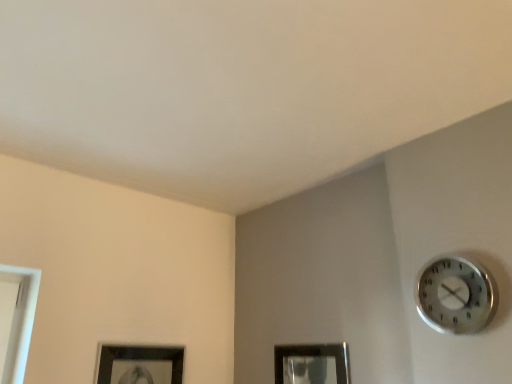
Question: Should I look upward or downward to see matte black picture frame at lower center?

Choices:
 (A) up
 (B) down

Answer: (B)

Question: Considering the relative sizes of silver metallic clock at upper right and matte black picture frame at lower center in the image provided, is silver metallic clock at upper right smaller than matte black picture frame at lower center?

Choices:
 (A) yes
 (B) no

Answer: (B)

Question: Is silver metallic clock at upper right taller than matte black picture frame at lower center?

Choices:
 (A) no
 (B) yes

Answer: (A)

Question: Considering the relative sizes of silver metallic clock at upper right and matte black picture frame at lower center in the image provided, is silver metallic clock at upper right wider than matte black picture frame at lower center?

Choices:
 (A) no
 (B) yes

Answer: (B)

Question: Is silver metallic clock at upper right surrounding matte black picture frame at lower center?

Choices:
 (A) yes
 (B) no

Answer: (B)

Question: Is the position of silver metallic clock at upper right more distant than that of matte black picture frame at lower center?

Choices:
 (A) yes
 (B) no

Answer: (B)

Question: From a real-world perspective, is silver metallic clock at upper right positioned under matte black picture frame at lower center based on gravity?

Choices:
 (A) yes
 (B) no

Answer: (B)

Question: From the image's perspective, does matte black picture frame at lower center appear lower than silver metallic clock at upper right?

Choices:
 (A) no
 (B) yes

Answer: (B)

Question: Does matte black picture frame at lower center have a lesser height compared to silver metallic clock at upper right?

Choices:
 (A) no
 (B) yes

Answer: (A)

Question: From a real-world perspective, is matte black picture frame at lower center positioned under silver metallic clock at upper right based on gravity?

Choices:
 (A) yes
 (B) no

Answer: (A)

Question: From a real-world perspective, is matte black picture frame at lower center physically above silver metallic clock at upper right?

Choices:
 (A) no
 (B) yes

Answer: (A)

Question: Is silver metallic clock at upper right at the back of matte black picture frame at lower center?

Choices:
 (A) yes
 (B) no

Answer: (B)

Question: Is matte black picture frame at lower center to the right of silver metallic clock at upper right from the viewer's perspective?

Choices:
 (A) yes
 (B) no

Answer: (B)

Question: Based on their positions, is matte black picture frame at lower center located to the left or right of silver metallic clock at upper right?

Choices:
 (A) right
 (B) left

Answer: (B)